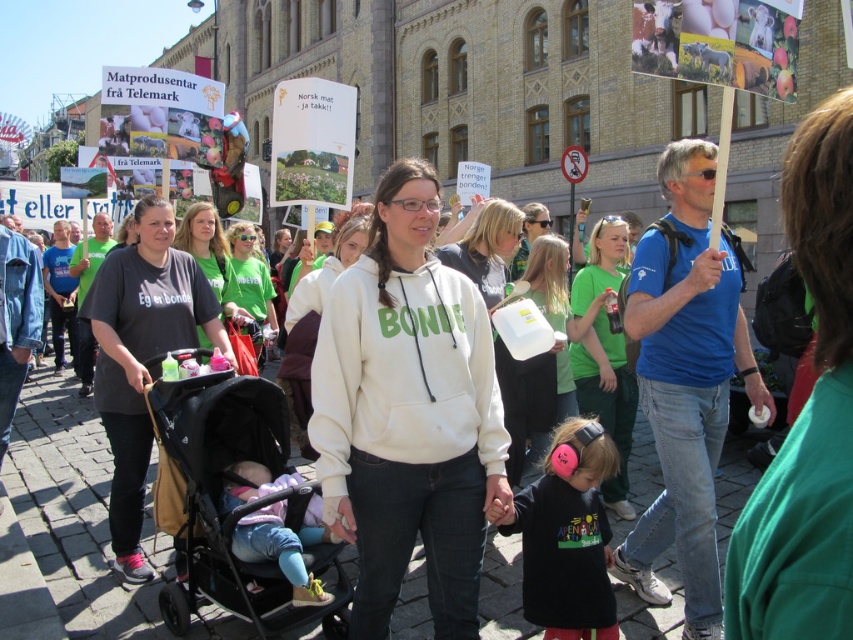
Looking at this image, you are standing at the point marked by the coordinates point at (376,372). You want to walk to the historic building with arched windows. The distance between you and the building is 79.13 feet. If you walk at a speed of 3 feet per second, how many seconds will it take you to reach the building?

The distance between the point at (376,372) and the historic building with arched windows is 79.13 feet. At a speed of 3 feet per second, it will take 79.13 divided by 3, which is approximately 26.38 seconds to reach the building.